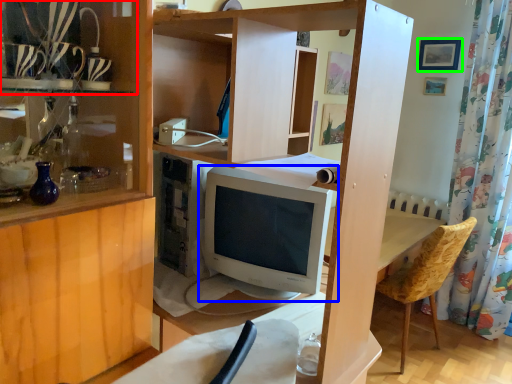
Question: Which object is positioned closest to shelf (highlighted by a red box)? Select from computer monitor (highlighted by a blue box) and picture frame (highlighted by a green box).

Choices:
 (A) computer monitor
 (B) picture frame

Answer: (A)